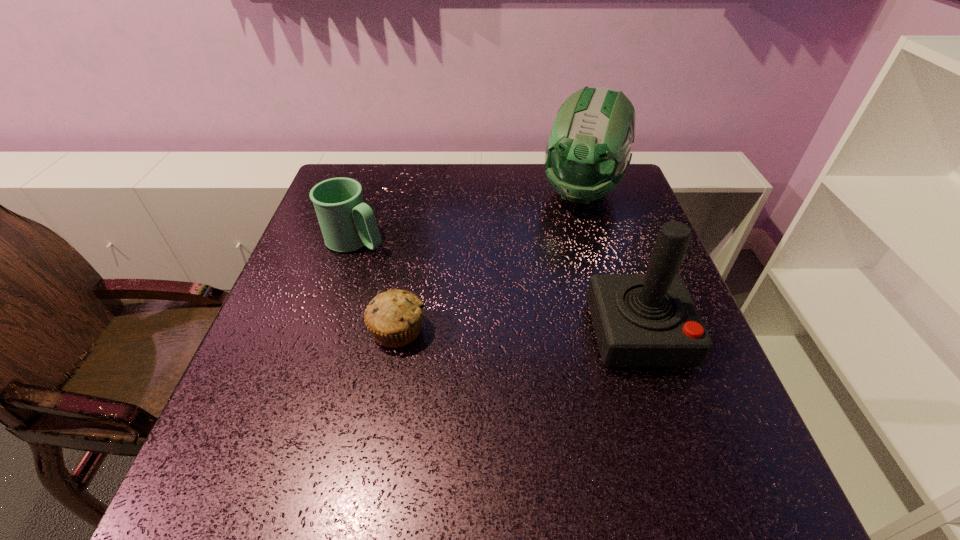
In the image, there is a desktop. At what (x,y) coordinates should I click in order to perform the action: click on blank space at the near edge. Please return your answer as a coordinate pair (x, y). The width and height of the screenshot is (960, 540). Looking at the image, I should click on (384, 434).

In the image, there is a desktop. Where is `vacant space at the left edge`? vacant space at the left edge is located at coordinates (306, 240).

Where is `vacant area at the right edge`? The image size is (960, 540). vacant area at the right edge is located at coordinates (615, 232).

This screenshot has width=960, height=540. In the image, there is a desktop. Find the location of `vacant space at the far left corner`. vacant space at the far left corner is located at coordinates (371, 173).

Where is `free space at the near left corner`? This screenshot has height=540, width=960. free space at the near left corner is located at coordinates (270, 426).

You are a GUI agent. You are given a task and a screenshot of the screen. Output one action in this format:
    pyautogui.click(x=<x>, y=<y>)
    Task: Click on the vacant space at the near right corner of the desktop
    
    Given the screenshot: What is the action you would take?
    pyautogui.click(x=683, y=440)

This screenshot has height=540, width=960. I want to click on blank region between the leftmost object and the shortest object, so click(376, 286).

The image size is (960, 540). I want to click on blank region between the farthest object and the leftmost object, so click(468, 217).

Identify the location of empty space between the third object from right to left and the farthest object. (490, 261).

Identify the location of free space between the third object from right to left and the joystick. (517, 332).